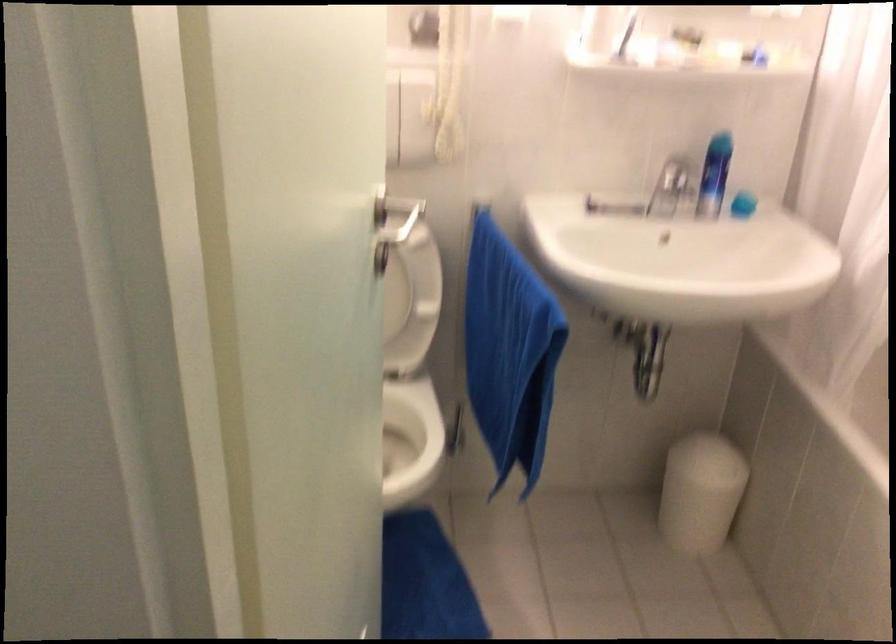
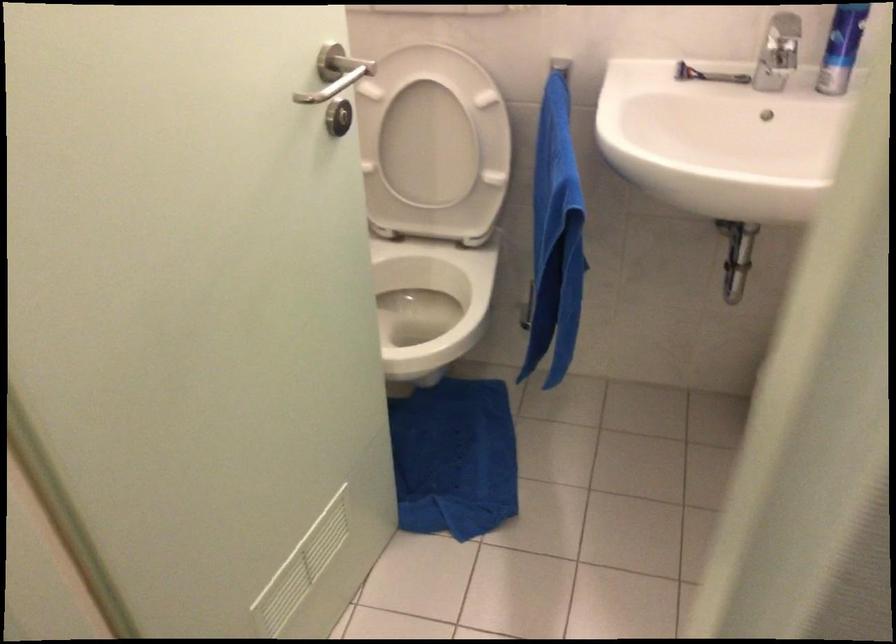
Question: The images are taken continuously from a first-person perspective. In which direction are you moving?

Choices:
 (A) Left
 (B) Right
 (C) Forward
 (D) Backward

Answer: (B)